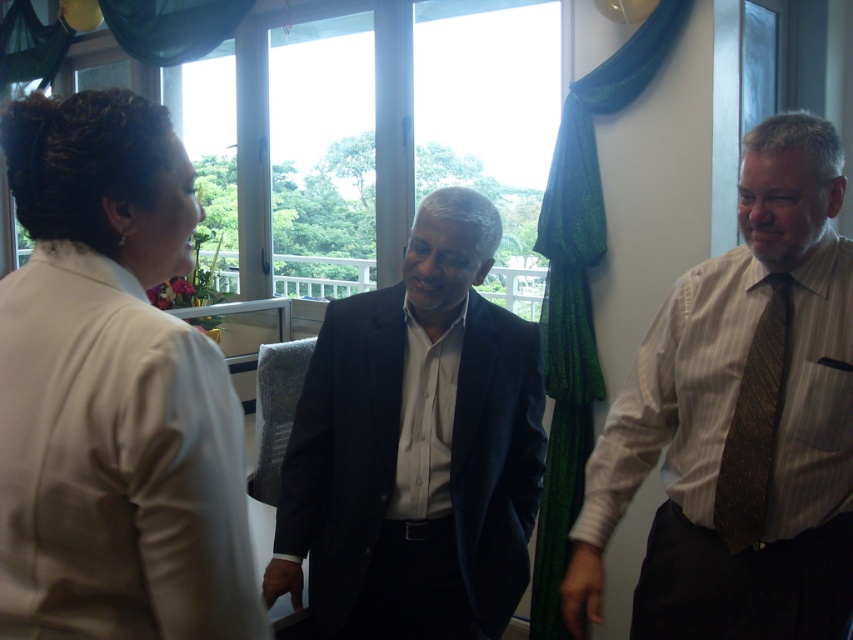
Is point (140, 289) more distant than point (735, 552)?

No, it is not.

Between white satin blouse at upper left and brown textured tie at right, which one is positioned higher?

white satin blouse at upper left is higher up.

Is point (32, 216) less distant than point (769, 282)?

Yes, it is in front of point (769, 282).

Where is `white satin blouse at upper left`? This screenshot has height=640, width=853. white satin blouse at upper left is located at coordinates (112, 392).

What are the coordinates of `dark blue suit at center` in the screenshot? It's located at (415, 448).

Is dark blue suit at center bigger than brown textured tie at right?

Indeed, dark blue suit at center has a larger size compared to brown textured tie at right.

Who is more forward, (x=273, y=576) or (x=747, y=401)?

Point (x=747, y=401) is more forward.

Locate an element on the screen. The height and width of the screenshot is (640, 853). dark blue suit at center is located at coordinates (415, 448).

Between striped cotton shirt at right and brown textured tie at right, which one has more height?

Standing taller between the two is striped cotton shirt at right.

Describe the element at coordinates (740, 420) in the screenshot. The height and width of the screenshot is (640, 853). I see `striped cotton shirt at right` at that location.

Between point (683, 458) and point (733, 477), which one is positioned in front?

Point (733, 477) is in front.

The height and width of the screenshot is (640, 853). I want to click on striped cotton shirt at right, so tap(740, 420).